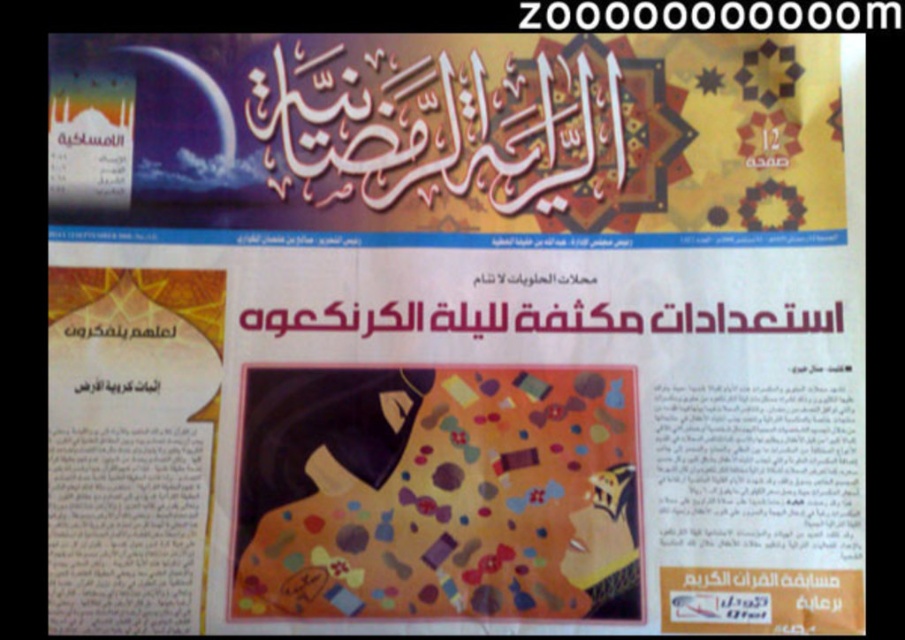
You have a ruler that is 12 inches long. You want to measure the space between the multicolored fabric blanket at center and the matte black text at lower left. Can you measure the entire distance with your ruler?

The distance between the multicolored fabric blanket at center and the matte black text at lower left is 11.61 inches. Since your ruler is 12 inches long, you can measure the entire distance as it is slightly shorter than the ruler.

You are designing a layout for a magazine article and need to ensure proper hierarchy between the matte black text at upper left and the matte black text at lower left. Based on their sizes, which one should be prioritized as the main title?

The matte black text at upper left should be prioritized as the main title since it has a greater height compared to the matte black text at lower left, indicating it holds more importance in the visual hierarchy.

You are a tailor measuring the distance between the multicolored fabric blanket at center and the decorative patterns in the header. Can you fit a 12 inch ruler between them?

The distance between the multicolored fabric blanket at center and the decorative patterns in the header is 33.09 inches, which is greater than the 12 inch ruler, so yes, the ruler can fit between them.